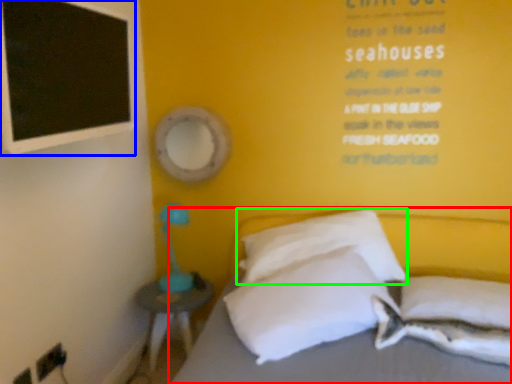
Question: Which object is positioned closest to bed (highlighted by a red box)? Select from bulletin board (highlighted by a blue box) and pillow (highlighted by a green box).

Choices:
 (A) bulletin board
 (B) pillow

Answer: (B)